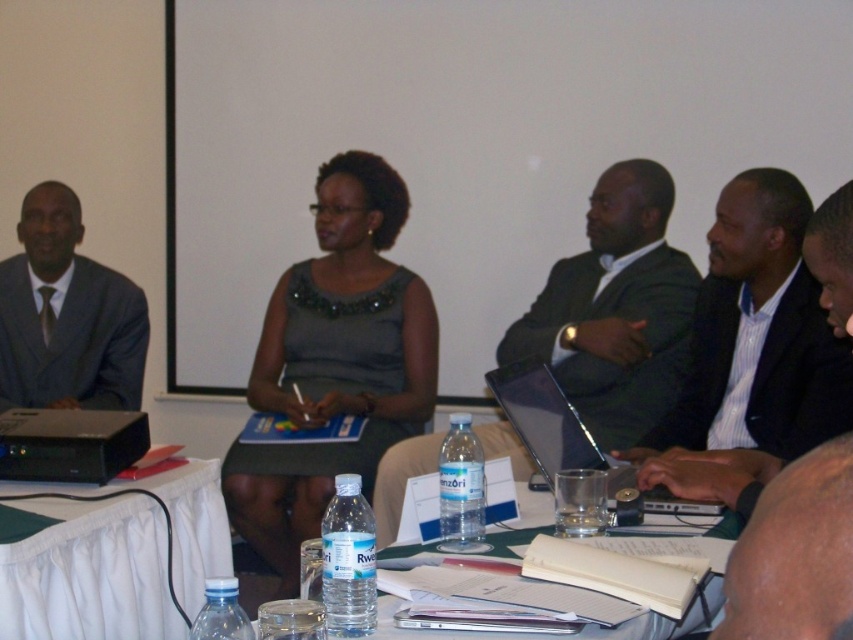
You are a photographer standing at a distance of 20 inches from the smooth black laptop at center. Can you adjust your position to ensure the laptop is in focus without moving the laptop itself?

The smooth black laptop at center is 19.49 inches away from the camera. Since you are standing 20 inches away, you can move slightly closer to match the focal distance of 19.49 inches, ensuring the laptop remains in focus without moving it.

You are organizing a small event and need to seat 10 guests. You have access to the white fabric table at lower left and the green fabric table at center. Based on their sizes, which table would be more suitable for accommodating more guests?

The green fabric table at center has a greater width than the white fabric table at lower left, making it more suitable for accommodating more guests due to its larger size.